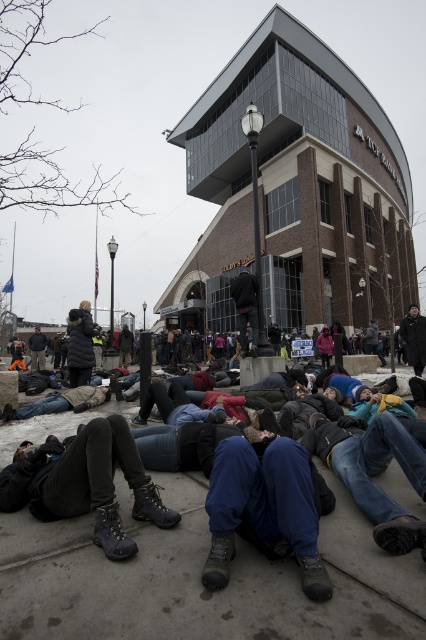
You are a photographer standing at the edge of the protest area. You want to take a photo of the black puffy coat at center without the dark gray leather boots at lower left blocking it. Is it possible to adjust your position to achieve this?

The dark gray leather boots at lower left is in front of the black puffy coat at center, so moving your position to the side or behind the boots might allow you to capture the coat without obstruction.

You are a photographer standing at the center of the scene. You want to capture a photo that includes the dark gray leather boots at lower left. Based on their coordinates, where should you position your camera to ensure they are in the frame?

To include the dark gray leather boots at lower left positioned at coordinates point (x=86, y=483), you should position your camera slightly to the right and lower portion of the scene to ensure the boots are within the frame.